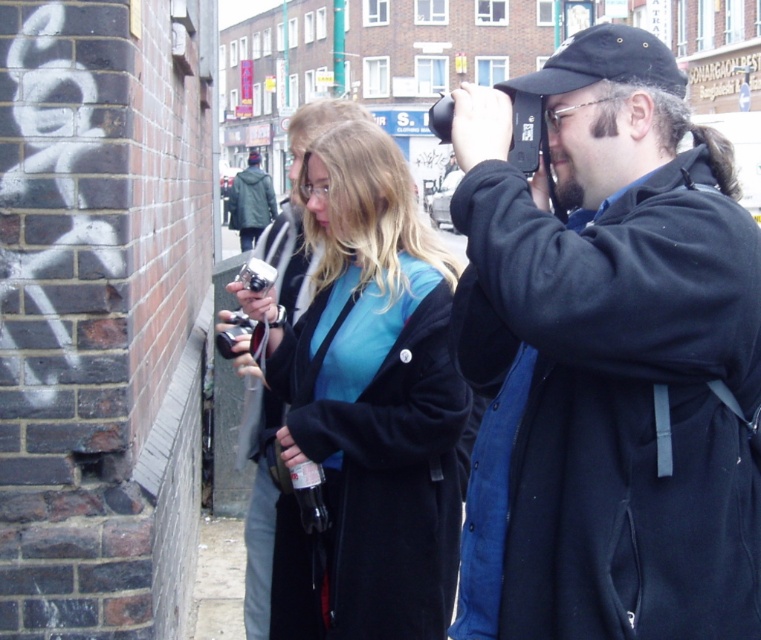
Between point (516, 336) and point (428, 330), which one is positioned in front?

Point (516, 336) is more forward.

What are the coordinates of `matte black jacket at center` in the screenshot? It's located at (607, 358).

Can you confirm if blue matte jacket at center is positioned below green matte jacket at center?

Yes, blue matte jacket at center is below green matte jacket at center.

Is point (365, 592) less distant than point (250, 221)?

Yes, it is.

You are a GUI agent. You are given a task and a screenshot of the screen. Output one action in this format:
    pyautogui.click(x=<x>, y=<y>)
    Task: Click on the blue matte jacket at center
    This screenshot has width=761, height=640.
    Given the screenshot: What is the action you would take?
    pyautogui.click(x=368, y=404)

Where is `matte black jacket at center`? This screenshot has height=640, width=761. matte black jacket at center is located at coordinates (607, 358).

Does matte black jacket at center appear on the left side of green matte jacket at center?

Incorrect, matte black jacket at center is not on the left side of green matte jacket at center.

Where is `matte black jacket at center`? The image size is (761, 640). matte black jacket at center is located at coordinates (607, 358).